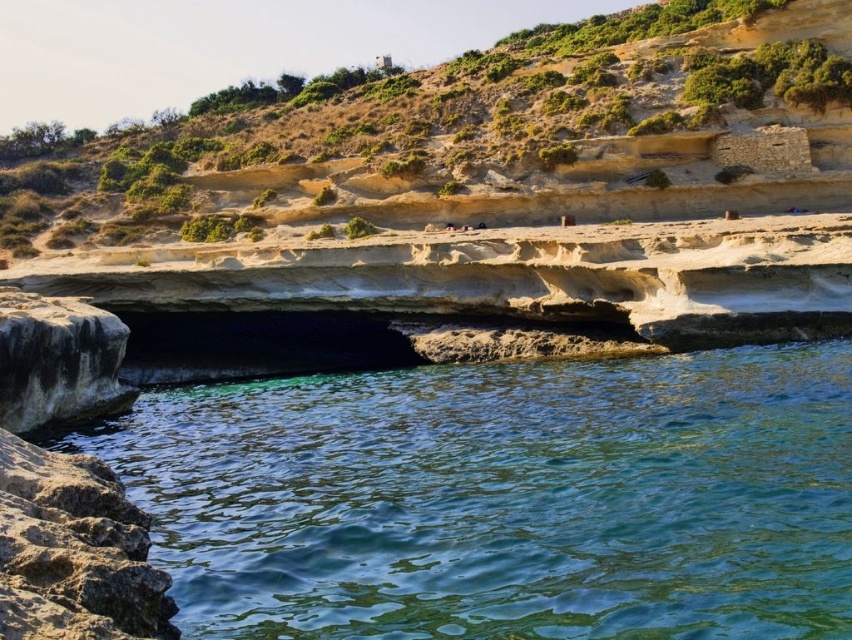
Question: Which point is farther to the camera?

Choices:
 (A) (171, 408)
 (B) (9, 356)
 (C) (793, 148)
 (D) (125, 588)

Answer: (C)

Question: Does rough textured rock at lower left have a greater width compared to brown rough stone at upper right?

Choices:
 (A) no
 (B) yes

Answer: (B)

Question: Can you confirm if clear water at lower center is positioned to the right of rustic stone cliff at center?

Choices:
 (A) no
 (B) yes

Answer: (B)

Question: Can you confirm if clear water at lower center is positioned to the right of brown rough stone at upper right?

Choices:
 (A) yes
 (B) no

Answer: (B)

Question: Estimate the real-world distances between objects in this image. Which object is closer to the brown rough stone at upper right?

Choices:
 (A) rough gray rock at lower left
 (B) rustic stone cliff at center
 (C) rough textured rock at lower left

Answer: (A)

Question: Which object is the closest to the rustic stone cliff at center?

Choices:
 (A) brown rough stone at upper right
 (B) rough gray rock at lower left

Answer: (B)